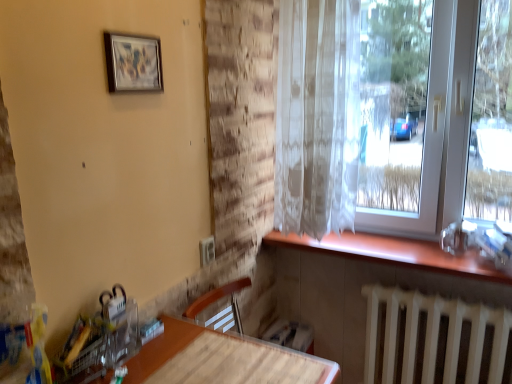
The image size is (512, 384). What do you see at coordinates (433, 336) in the screenshot?
I see `white metallic radiator at lower right` at bounding box center [433, 336].

Where is `wooden table at lower center`? This screenshot has width=512, height=384. wooden table at lower center is located at coordinates (222, 359).

Locate an element on the screen. wooden at lower right is located at coordinates (394, 253).

I want to click on white metallic radiator at lower right, so click(x=433, y=336).

Between matte wood table at lower left and wooden table at lower center, which one appears on the right side from the viewer's perspective?

wooden table at lower center.

From the image's perspective, which object appears higher, matte wood table at lower left or wooden table at lower center?

matte wood table at lower left appears higher in the image.

From a real-world perspective, is white translucent curtain at right physically below wooden table at lower center?

Incorrect, from a real-world perspective, white translucent curtain at right is higher than wooden table at lower center.

Is point (392, 213) in front of point (221, 373)?

No.

Is white translucent curtain at right looking in the opposite direction of wooden table at lower center?

No, white translucent curtain at right is not facing the opposite direction of wooden table at lower center.

Between white translucent curtain at right and wooden table at lower center, which one has smaller size?

wooden table at lower center.

Does wooden table at lower center have a lesser height compared to matte wood table at lower left?

Indeed, wooden table at lower center has a lesser height compared to matte wood table at lower left.

From a real-world perspective, is wooden table at lower center physically located above or below matte wood table at lower left?

From a real-world perspective, wooden table at lower center is physically below matte wood table at lower left.

In the image, is wooden table at lower center positioned in front of or behind matte wood table at lower left?

wooden table at lower center is behind matte wood table at lower left.

In the scene shown: Is wooden table at lower center to the right of matte wood table at lower left from the viewer's perspective?

Yes.

Is point (291, 18) closer to viewer compared to point (192, 187)?

That is False.

Is translucent white curtain at upper right located outside matte wood table at lower left?

translucent white curtain at upper right lies outside matte wood table at lower left's area.

Is translucent white curtain at upper right far from matte wood table at lower left?

They are positioned close to each other.

Between translucent white curtain at upper right and matte wood table at lower left, which one has larger size?

matte wood table at lower left is bigger.

Identify the location of backdrop beneath the white translucent curtain at right (from a real-world perspective). (105, 151).

Can you confirm if white translucent curtain at right is shorter than matte wood table at lower left?

Indeed, white translucent curtain at right has a lesser height compared to matte wood table at lower left.

Can you confirm if white translucent curtain at right is positioned to the left of matte wood table at lower left?

No, white translucent curtain at right is not to the left of matte wood table at lower left.

Does white translucent curtain at right have a larger size compared to matte wood table at lower left?

Result: Indeed, white translucent curtain at right has a larger size compared to matte wood table at lower left.

How different are the orientations of wooden at lower right and wooden table at lower center in degrees?

wooden at lower right and wooden table at lower center are facing 0.356 degrees away from each other.

Is wooden at lower right turned away from wooden table at lower center?

No, wooden at lower right is not facing away from wooden table at lower center.

Is wooden at lower right shorter than wooden table at lower center?

In fact, wooden at lower right may be taller than wooden table at lower center.

Is wooden at lower right thinner than wooden table at lower center?

Correct, the width of wooden at lower right is less than that of wooden table at lower center.

Are wooden at lower right and matte wood table at lower left far apart?

wooden at lower right is actually quite close to matte wood table at lower left.

Is point (337, 237) less distant than point (163, 93)?

No, (337, 237) is behind (163, 93).

Which is more to the right, wooden at lower right or matte wood table at lower left?

wooden at lower right.

Where is `backdrop located in front of the wooden table at lower center`? backdrop located in front of the wooden table at lower center is located at coordinates (105, 151).

At what (x,y) coordinates should I click in order to perform the action: click on window behind the wooden table at lower center. Please return your answer as a coordinate pair (x, y). Looking at the image, I should click on click(x=365, y=113).

Estimate the real-world distances between objects in this image. Which object is further from matte wood table at lower left, white metallic radiator at lower right or wooden table at lower center?

white metallic radiator at lower right is further to matte wood table at lower left.

Which object lies further to the anchor point matte wood table at lower left, wooden at lower right or wooden table at lower center?

Among the two, wooden at lower right is located further to matte wood table at lower left.

From the image, which object appears to be farther from translucent white curtain at upper right, wooden at lower right or white metallic radiator at lower right?

white metallic radiator at lower right lies further to translucent white curtain at upper right than the other object.

Considering their positions, is white translucent curtain at right positioned further to translucent white curtain at upper right than white metallic radiator at lower right?

Based on the image, white metallic radiator at lower right appears to be further to translucent white curtain at upper right.

Considering their positions, is white metallic radiator at lower right positioned closer to translucent white curtain at upper right than wooden table at lower center?

Among the two, white metallic radiator at lower right is located nearer to translucent white curtain at upper right.

Considering their positions, is white metallic radiator at lower right positioned further to wooden table at lower center than white translucent curtain at right?

white translucent curtain at right.

From the image, which object appears to be nearer to wooden table at lower center, matte wood table at lower left or white translucent curtain at right?

The object closer to wooden table at lower center is matte wood table at lower left.

Considering their positions, is white translucent curtain at right positioned closer to matte wood table at lower left than wooden at lower right?

Based on the image, white translucent curtain at right appears to be nearer to matte wood table at lower left.

This screenshot has width=512, height=384. I want to click on window sill between translucent white curtain at upper right and white metallic radiator at lower right in the vertical direction, so click(394, 253).

Image resolution: width=512 pixels, height=384 pixels. In order to click on table between matte wood table at lower left and white metallic radiator at lower right from left to right in this screenshot , I will do `click(222, 359)`.

Locate an element on the screen. Image resolution: width=512 pixels, height=384 pixels. backdrop between translucent white curtain at upper right and white metallic radiator at lower right in the vertical direction is located at coordinates (105, 151).

Where is `table positioned between matte wood table at lower left and translucent white curtain at upper right from near to far`? table positioned between matte wood table at lower left and translucent white curtain at upper right from near to far is located at coordinates (222, 359).